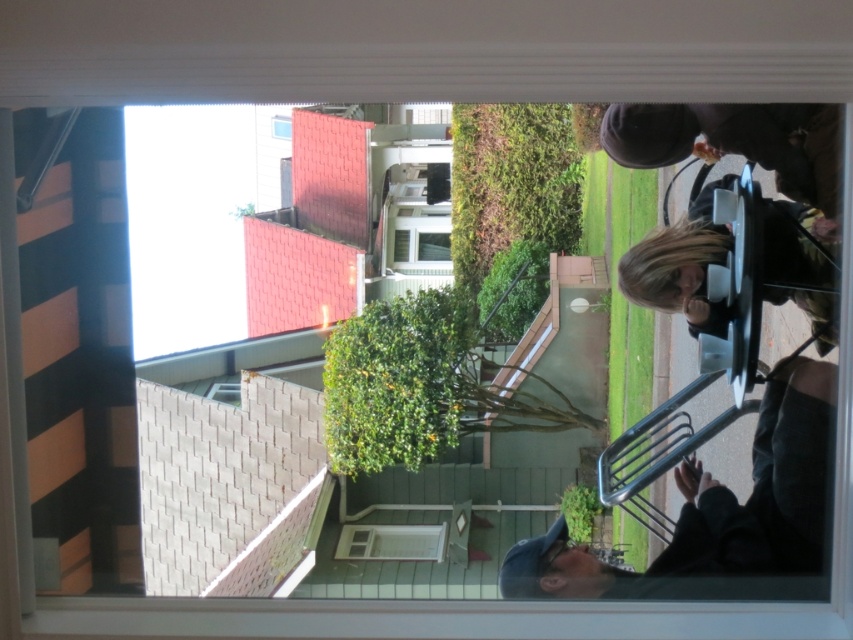
Question: Does dark gray fabric jacket at lower right appear over matte glass window at upper center?

Choices:
 (A) yes
 (B) no

Answer: (B)

Question: In this image, where is blonde hair at lower right located relative to matte glass window at upper center?

Choices:
 (A) right
 (B) left

Answer: (A)

Question: Which object is positioned closest to the blonde hair at lower right?

Choices:
 (A) dark gray fabric jacket at lower right
 (B) matte glass window at upper center

Answer: (A)

Question: Can you confirm if dark gray fabric jacket at lower right is positioned to the left of matte glass window at upper center?

Choices:
 (A) yes
 (B) no

Answer: (B)

Question: Considering the real-world distances, which object is closest to the blonde hair at lower right?

Choices:
 (A) dark gray fabric jacket at lower right
 (B) matte glass window at upper center

Answer: (A)

Question: Estimate the real-world distances between objects in this image. Which object is farther from the matte glass window at upper center?

Choices:
 (A) dark gray fabric jacket at lower right
 (B) blonde hair at lower right

Answer: (A)